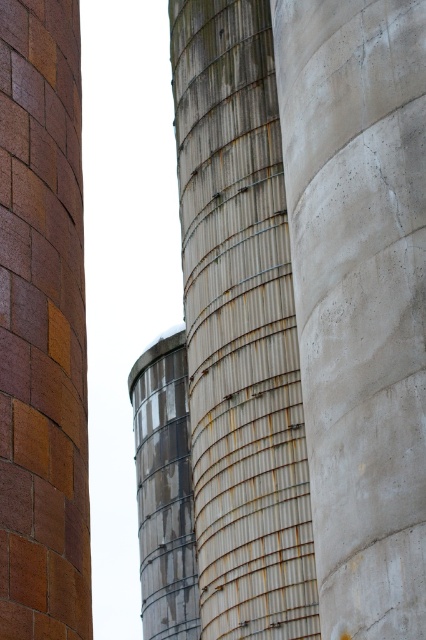
Question: Among these objects, which one is nearest to the camera?

Choices:
 (A) rusty metal silo at center
 (B) multicolored brick chimney at left

Answer: (B)

Question: Which point is farther to the camera?

Choices:
 (A) multicolored brick chimney at left
 (B) rusty metal silo at center

Answer: (B)

Question: Is rusty metal silo at center thinner than multicolored brick chimney at left?

Choices:
 (A) no
 (B) yes

Answer: (A)

Question: Which point is closer to the camera?

Choices:
 (A) (376, 531)
 (B) (250, 29)
 (C) (54, 552)

Answer: (A)

Question: In this image, where is smooth concrete pillar at center located relative to rusty metal silo at center?

Choices:
 (A) below
 (B) above

Answer: (B)

Question: Can you confirm if smooth concrete pillar at center is positioned to the left of multicolored brick chimney at left?

Choices:
 (A) no
 (B) yes

Answer: (A)